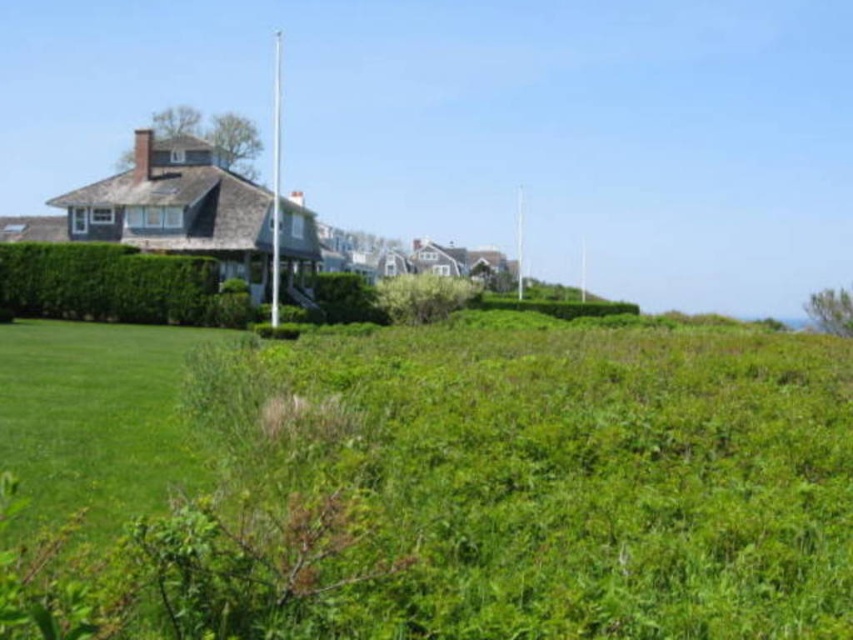
Question: Which point is farther from the camera taking this photo?

Choices:
 (A) (126, 248)
 (B) (186, 346)
 (C) (515, 280)

Answer: (C)

Question: Observing the image, what is the correct spatial positioning of green leafy grass at center in reference to green leafy hedge at center?

Choices:
 (A) below
 (B) above

Answer: (A)

Question: Which object is positioned farthest from the white metallic flag pole at center?

Choices:
 (A) metallic flag pole at center
 (B) green leafy hedge at center

Answer: (A)

Question: Does green leafy hedge at center come in front of white metallic flag pole at center?

Choices:
 (A) yes
 (B) no

Answer: (A)

Question: Does green leafy grass at center have a lesser width compared to white metallic flag pole at center?

Choices:
 (A) yes
 (B) no

Answer: (B)

Question: Which object appears closest to the camera in this image?

Choices:
 (A) white metallic flag pole at center
 (B) green leafy grass at center

Answer: (B)